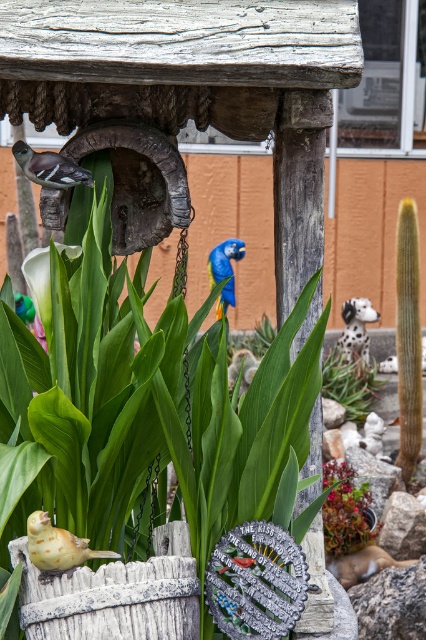
Can you confirm if matte green succulent at center is positioned below white matte calla lily at center?

Indeed, matte green succulent at center is positioned under white matte calla lily at center.

Image resolution: width=426 pixels, height=640 pixels. What do you see at coordinates (345, 509) in the screenshot?
I see `matte green succulent at center` at bounding box center [345, 509].

The width and height of the screenshot is (426, 640). I want to click on matte green succulent at center, so click(x=345, y=509).

Locate an element on the screen. The width and height of the screenshot is (426, 640). matte green succulent at center is located at coordinates (345, 509).

At what (x,y) coordinates should I click in order to perform the action: click on green leafy plant at center. Please return your answer as a coordinate pair (x, y). Looking at the image, I should click on point(350,385).

Can you confirm if green leafy plant at center is positioned below blue glossy parrot at center?

Yes, green leafy plant at center is below blue glossy parrot at center.

Is point (351, 362) positioned before point (221, 256)?

Yes, point (351, 362) is in front of point (221, 256).

This screenshot has width=426, height=640. I want to click on green leafy plant at center, so click(350, 385).

Consider the image. Does matte green succulent at center have a larger size compared to blue glossy parrot at center?

Yes, matte green succulent at center is bigger than blue glossy parrot at center.

Is point (368, 483) more distant than point (230, 266)?

No, (368, 483) is in front of (230, 266).

Identify the location of matte green succulent at center. This screenshot has height=640, width=426. (345, 509).

Where is `matte green succulent at center`? The width and height of the screenshot is (426, 640). matte green succulent at center is located at coordinates (345, 509).